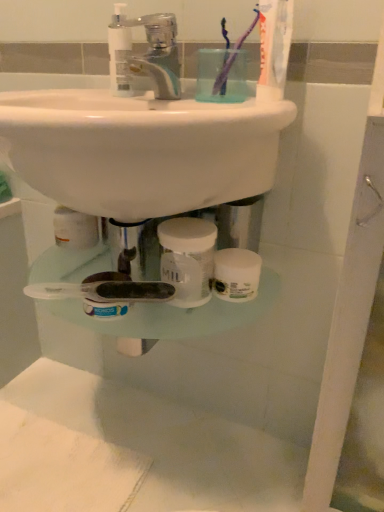
Find the location of a particular element. vacant space situated on the left part of transparent plastic mouthwash at upper center, the 1th mouthwash viewed from the top is located at coordinates (69, 93).